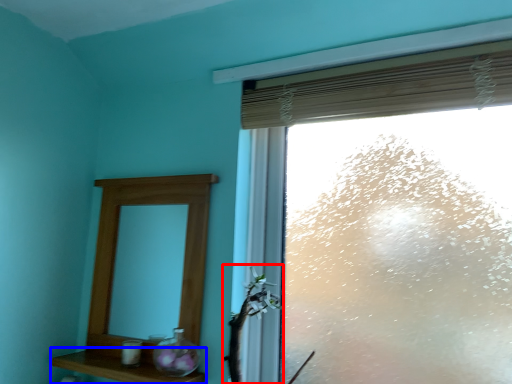
Question: Which object appears closest to the camera in this image, plant (highlighted by a red box) or shelf (highlighted by a blue box)?

Choices:
 (A) plant
 (B) shelf

Answer: (A)